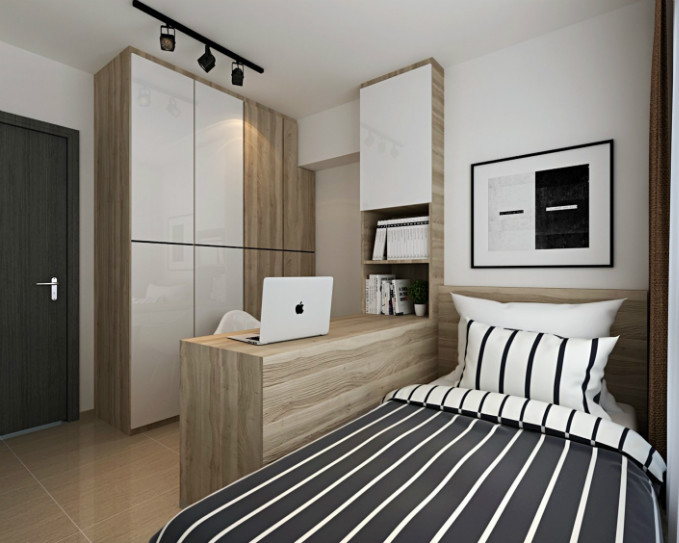
Where is `duvet`? The width and height of the screenshot is (679, 543). duvet is located at coordinates (470, 453).